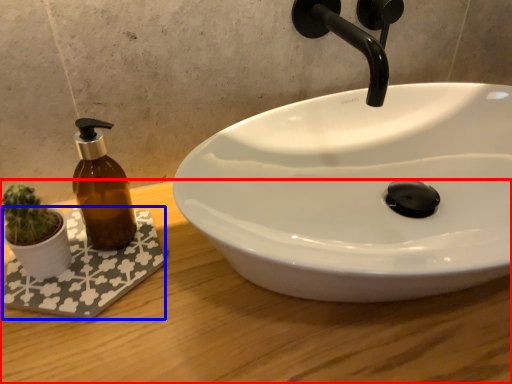
Question: Which object is closer to the camera taking this photo, counter top (highlighted by a red box) or bath mat (highlighted by a blue box)?

Choices:
 (A) counter top
 (B) bath mat

Answer: (A)